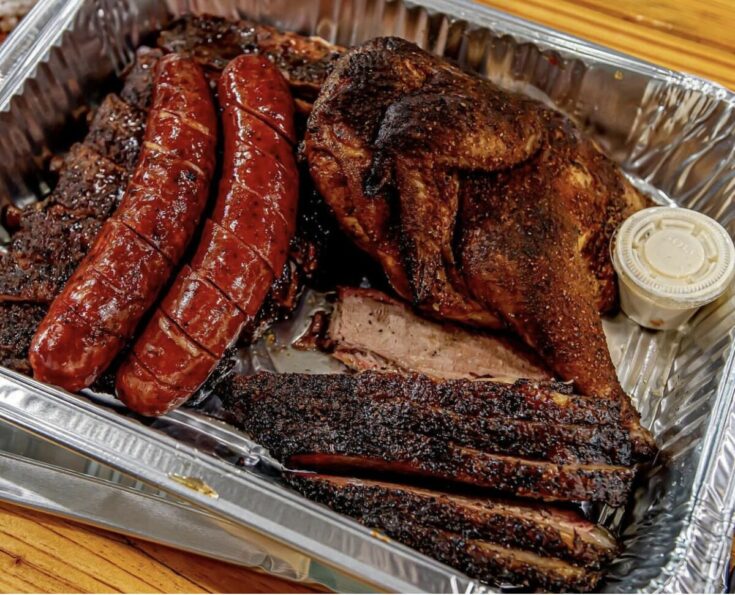
Identify the location of condiment inside of plastic container. (642, 308).